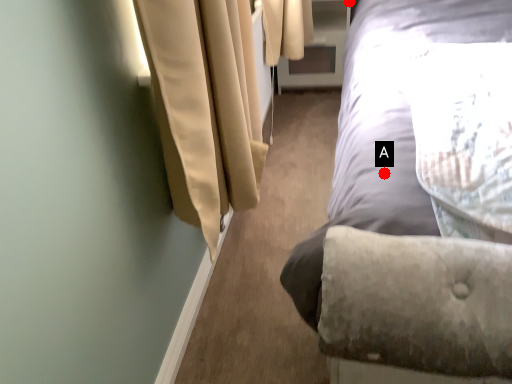
Question: Two points are circled on the image, labeled by A and B beside each circle. Which point is further to the camera?

Choices:
 (A) A is further
 (B) B is further

Answer: (B)